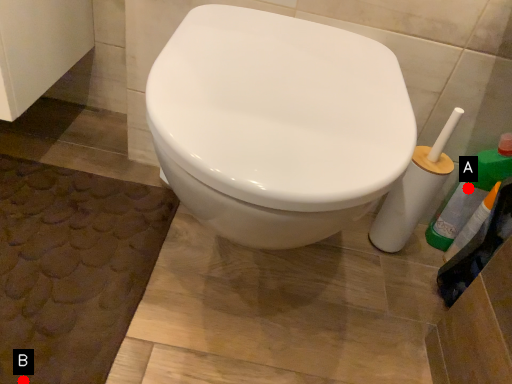
Question: Two points are circled on the image, labeled by A and B beside each circle. Which point is closer to the camera taking this photo?

Choices:
 (A) A is closer
 (B) B is closer

Answer: (B)